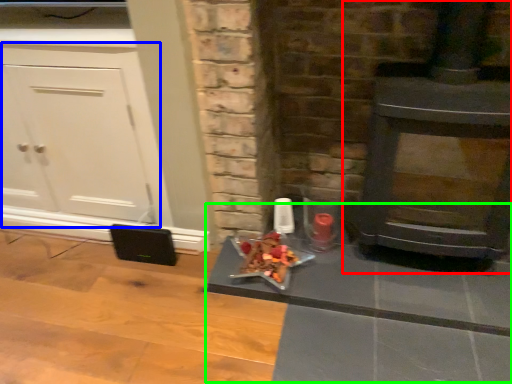
Question: Which object is the farthest from wood burning stove (highlighted by a red box)? Choose among these: cabinetry (highlighted by a blue box) or table (highlighted by a green box).

Choices:
 (A) cabinetry
 (B) table

Answer: (A)